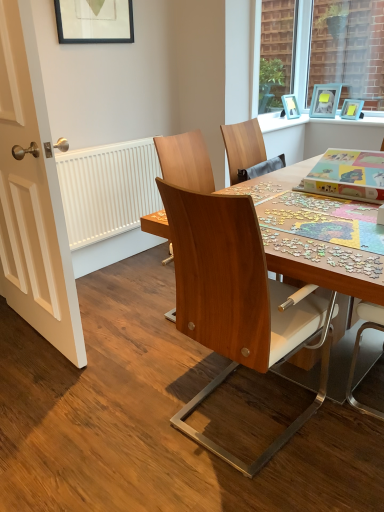
In order to click on free space in front of white painted wood door at left in this screenshot , I will do `click(49, 390)`.